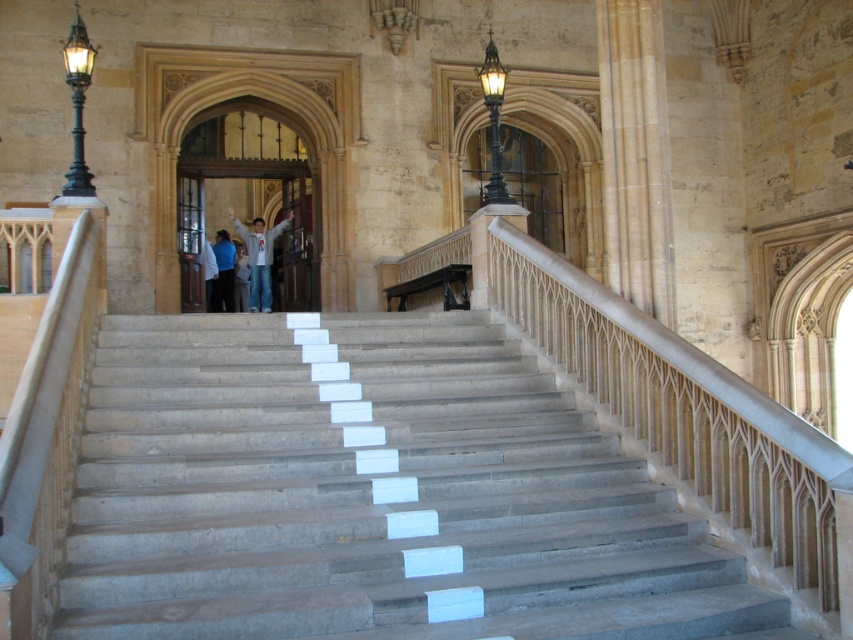
You are a painter carrying a 1.2 meter wide canvas. You are standing at the bottom of the gray stone stairs at center and see the blue denim jeans at center on the step above. Can you move the canvas up the stairs while keeping it centered between both sides?

The gray stone stairs at center are wider than the blue denim jeans at center. Since the stairs are wider, there should be enough space to move the 1.2 meter wide canvas up while keeping it centered between both sides.

You are standing at the bottom of the gray stone stairs at center and want to reach the blue shirt at center. Which direction should you move?

The gray stone stairs at center is below the blue shirt at center, so you should move upward to reach the blue shirt at center.